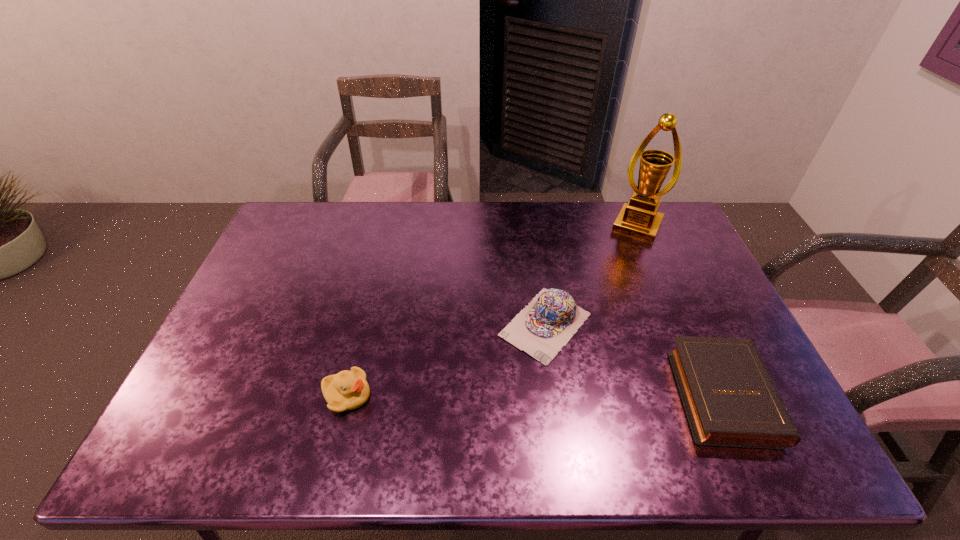
Image resolution: width=960 pixels, height=540 pixels. Find the location of `vacant space that's between the Bible and the award`. vacant space that's between the Bible and the award is located at coordinates (680, 310).

Find the location of `free spot between the cap and the award`. free spot between the cap and the award is located at coordinates (591, 275).

The width and height of the screenshot is (960, 540). What are the coordinates of `empty space that is in between the Bible and the farthest object` in the screenshot? It's located at (680, 310).

You are a GUI agent. You are given a task and a screenshot of the screen. Output one action in this format:
    pyautogui.click(x=<x>, y=<y>)
    Task: Click on the object that can be found as the closest to the duckling
    This screenshot has height=540, width=960.
    Given the screenshot: What is the action you would take?
    pyautogui.click(x=541, y=329)

I want to click on object that is the second closest to the third object from right to left, so click(x=640, y=219).

Identify the location of vacant space that satisfies the following two spatial constraints: 1. on the front side of the Bible; 2. on the left side of the cap. (555, 394).

Find the location of a particular element. This screenshot has width=960, height=540. vacant area in the image that satisfies the following two spatial constraints: 1. on the front side of the Bible; 2. on the left side of the award is located at coordinates (708, 394).